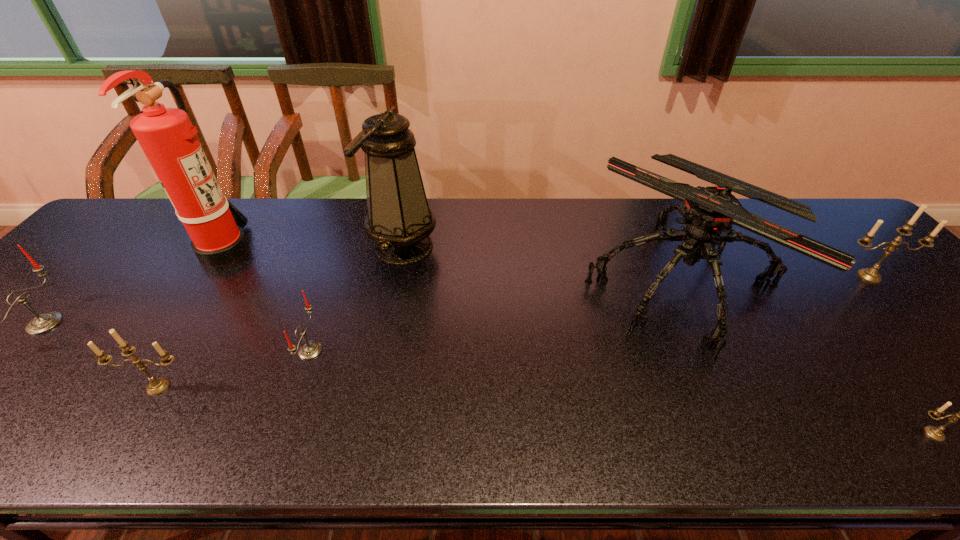
Where is `the second farthest metallic candle`? This screenshot has height=540, width=960. the second farthest metallic candle is located at coordinates (156, 386).

Locate an element on the screen. The height and width of the screenshot is (540, 960). the leftmost metallic candle is located at coordinates (156, 386).

Locate an element on the screen. The image size is (960, 540). the smaller red candle is located at coordinates (309, 350).

Where is `the fifth object from right to left`? the fifth object from right to left is located at coordinates (309, 350).

At what (x,y) coordinates should I click in order to perform the action: click on vacant space located at the nozzle of the fire extinguisher. Please return your answer as a coordinate pair (x, y). The image size is (960, 540). Looking at the image, I should click on (288, 249).

The image size is (960, 540). What are the coordinates of `free space located 0.080m on the left of the seventh shortest object` in the screenshot? It's located at (340, 247).

Locate an element on the screen. The width and height of the screenshot is (960, 540). free space located 0.070m on the back of the drone is located at coordinates (647, 213).

Where is `free spot located on the back of the rightmost object`? free spot located on the back of the rightmost object is located at coordinates coord(821,225).

The height and width of the screenshot is (540, 960). What are the coordinates of `vacant space located on the front-facing side of the left red candle` in the screenshot? It's located at (98, 323).

Locate an element on the screen. The image size is (960, 540). vacant space located on the back of the second candle from left to right is located at coordinates (187, 341).